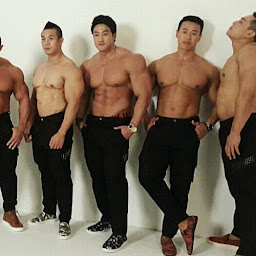
At what (x,y) coordinates should I click in order to perform the action: click on wall. Please return your answer as a coordinate pair (x, y). The width and height of the screenshot is (256, 256). Looking at the image, I should click on (157, 30).